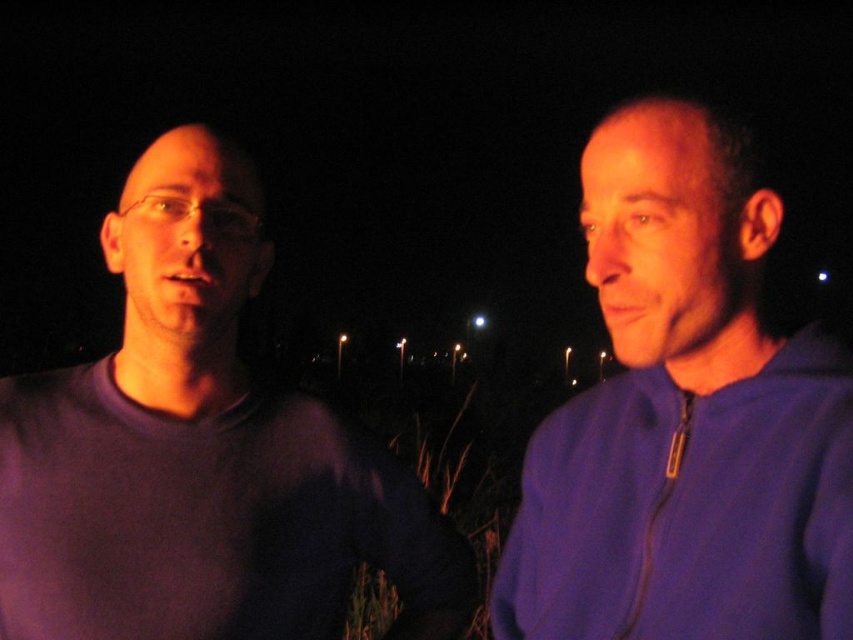
Can you confirm if purple matte shirt at left is positioned below purple zip-up jacket at right?

Yes, purple matte shirt at left is below purple zip-up jacket at right.

Which is behind, point (309, 444) or point (605, 173)?

The point (309, 444) is behind.

Locate an element on the screen. This screenshot has height=640, width=853. purple matte shirt at left is located at coordinates (200, 452).